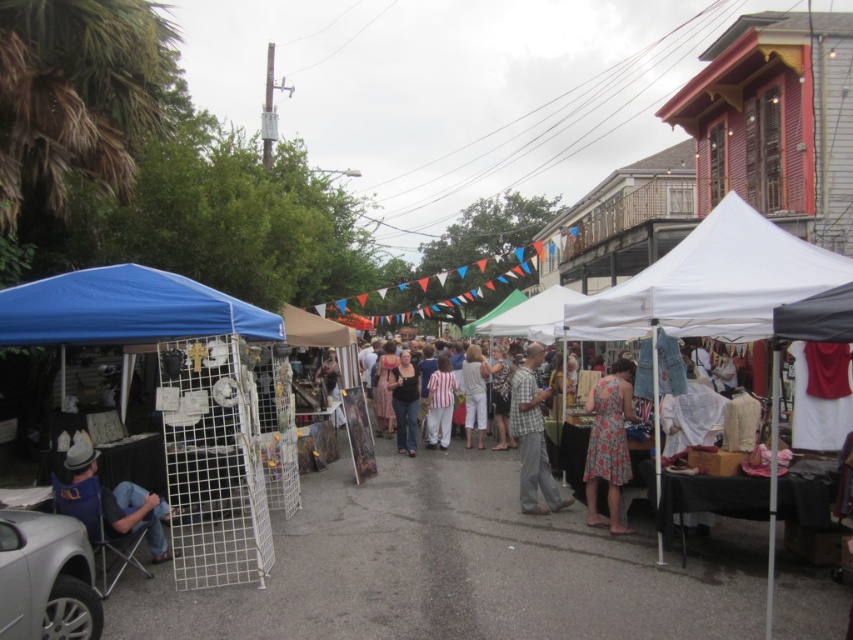
You are a customer at the market and want to buy a pair of jeans and a decorative cage. You see the white wire mesh cage at left and the denim jeans at lower left. Which item is positioned to the right of the other?

The white wire mesh cage at left is to the right of the denim jeans at lower left.

You are a customer at the market and want to pick up both the denim jeans at lower left and the matte black shirt at center. Which item should you reach for first if you want to grab the one that is closer to you?

The denim jeans at lower left is positioned under the matte black shirt at center, so it is closer to you. Reach for the denim jeans at lower left first.

You are a customer at the outdoor market and want to pick up both the denim jeans at lower left and the matte black shirt at center. Which item should you approach first to reach the closest one?

The denim jeans at lower left is closer to the viewer than the matte black shirt at center, so you should approach the denim jeans at lower left first.